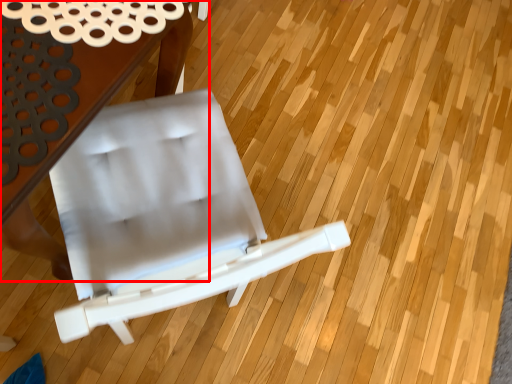
Question: From the image, what is the correct spatial relationship of table (annotated by the red box) in relation to chair?

Choices:
 (A) left
 (B) right

Answer: (A)